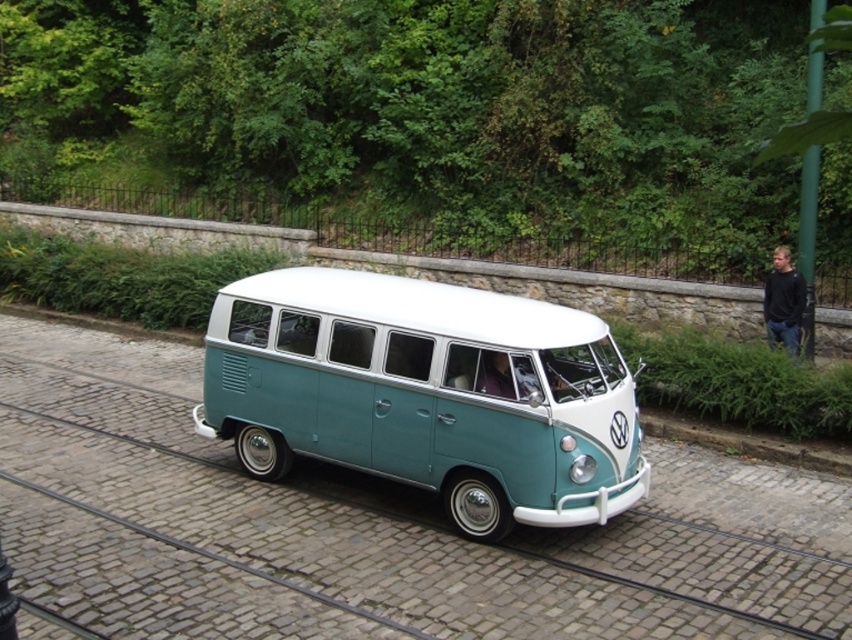
Does teal matte van at center have a lesser width compared to black cotton shirt at right?

Incorrect, teal matte van at center's width is not less than black cotton shirt at right's.

Which is in front, point (519, 352) or point (769, 294)?

Point (519, 352)

Where is `teal matte van at center`? Image resolution: width=852 pixels, height=640 pixels. teal matte van at center is located at coordinates pyautogui.click(x=426, y=394).

Is metal train track at center thinner than black cotton shirt at right?

No, metal train track at center is not thinner than black cotton shirt at right.

Does metal train track at center appear over black cotton shirt at right?

Actually, metal train track at center is below black cotton shirt at right.

The width and height of the screenshot is (852, 640). Describe the element at coordinates (407, 531) in the screenshot. I see `metal train track at center` at that location.

At what (x,y) coordinates should I click in order to perform the action: click on metal train track at center. Please return your answer as a coordinate pair (x, y). The image size is (852, 640). Looking at the image, I should click on (407, 531).

Is metal train track at center bigger than teal matte van at center?

Correct, metal train track at center is larger in size than teal matte van at center.

Between metal train track at center and teal matte van at center, which one has more height?

With more height is teal matte van at center.

Who is more distant from viewer, (x=364, y=499) or (x=488, y=342)?

Positioned behind is point (x=364, y=499).

At what (x,y) coordinates should I click in order to perform the action: click on metal train track at center. Please return your answer as a coordinate pair (x, y). The height and width of the screenshot is (640, 852). Looking at the image, I should click on (407, 531).